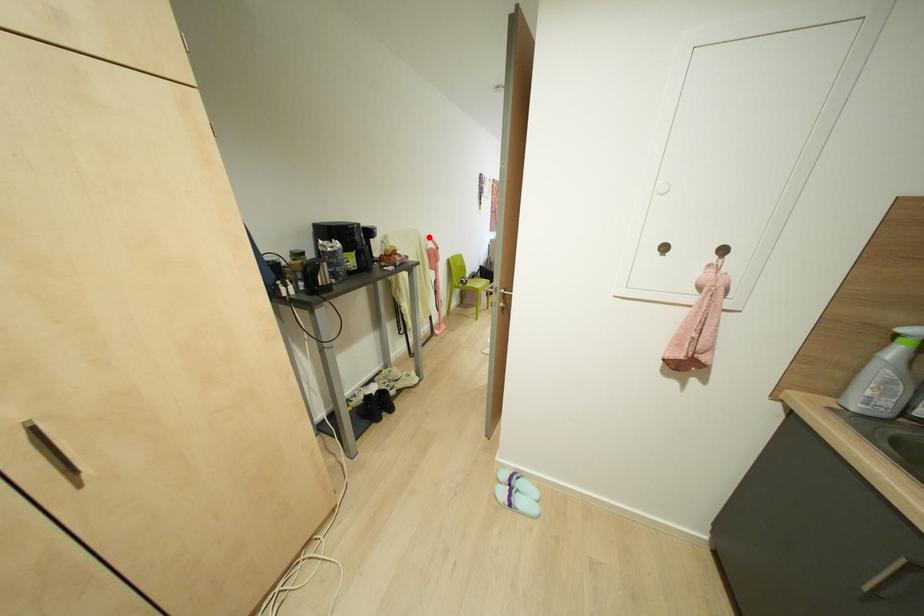
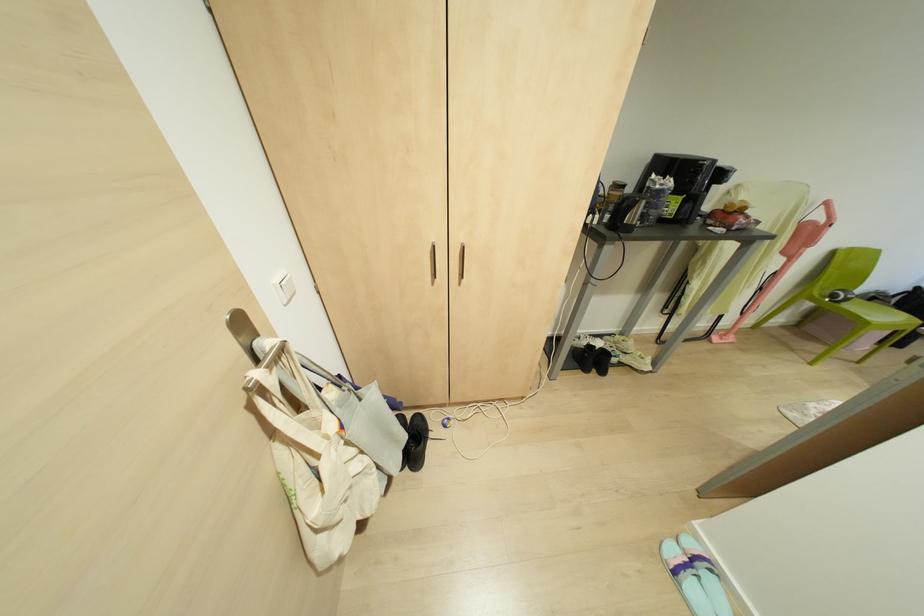
Find the pixel in the second image that matches the highlighted location in the first image.

(825, 203)